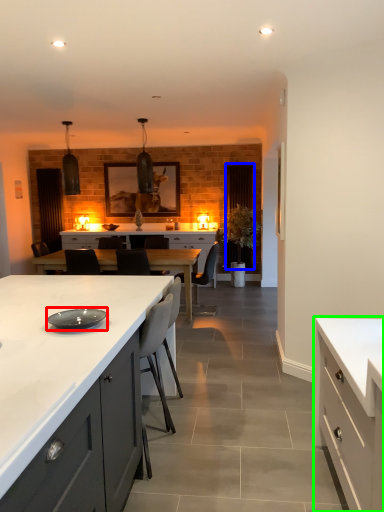
Question: Estimate the real-world distances between objects in this image. Which object is farther from plate (highlighted by a red box), glass door (highlighted by a blue box) or cabinetry (highlighted by a green box)?

Choices:
 (A) glass door
 (B) cabinetry

Answer: (A)